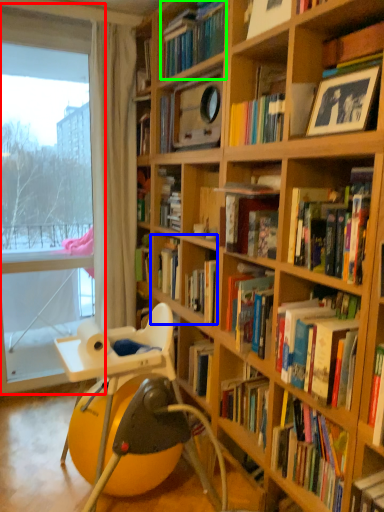
Question: Estimate the real-world distances between objects in this image. Which object is farther from window frame (highlighted by a red box), book (highlighted by a blue box) or book (highlighted by a green box)?

Choices:
 (A) book
 (B) book

Answer: (B)